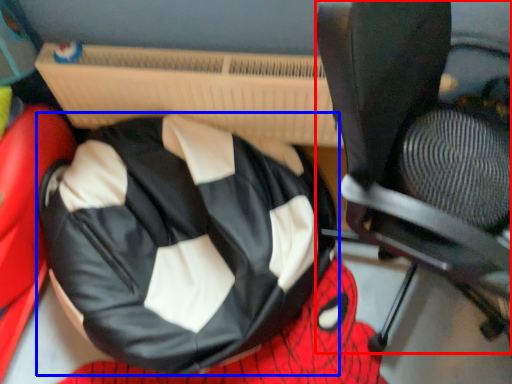
Question: Which point is further to the camera, chair (highlighted by a red box) or bean bag chair (highlighted by a blue box)?

Choices:
 (A) chair
 (B) bean bag chair

Answer: (B)